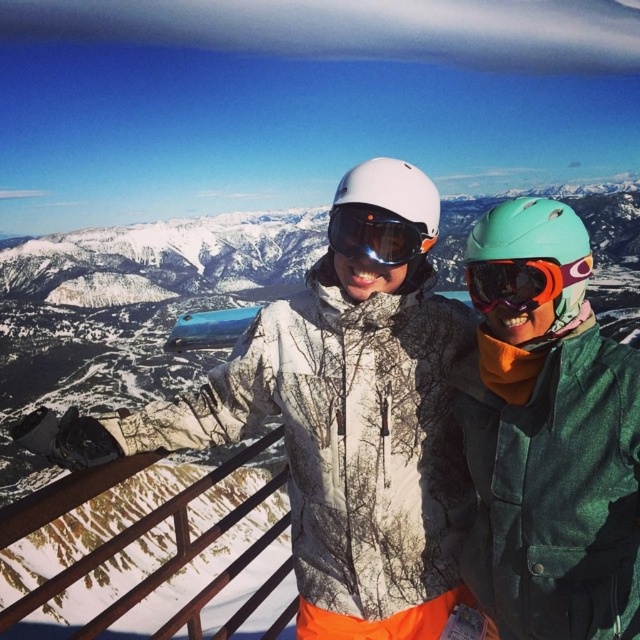
Question: Does matte green helmet at center appear under matte orange goggles at center?

Choices:
 (A) yes
 (B) no

Answer: (A)

Question: Which of the following is the closest to the observer?

Choices:
 (A) (452, 458)
 (B) (560, 360)

Answer: (B)

Question: Is camouflage jacket at center wider than matte orange goggles at center?

Choices:
 (A) no
 (B) yes

Answer: (B)

Question: Which point is farther to the camera?

Choices:
 (A) (470, 291)
 (B) (515, 529)

Answer: (A)

Question: Among these points, which one is nearest to the camera?

Choices:
 (A) (371, 168)
 (B) (518, 298)
 (C) (500, 282)

Answer: (B)

Question: Can you confirm if camouflage jacket at center is positioned to the right of matte orange goggles at center?

Choices:
 (A) no
 (B) yes

Answer: (A)